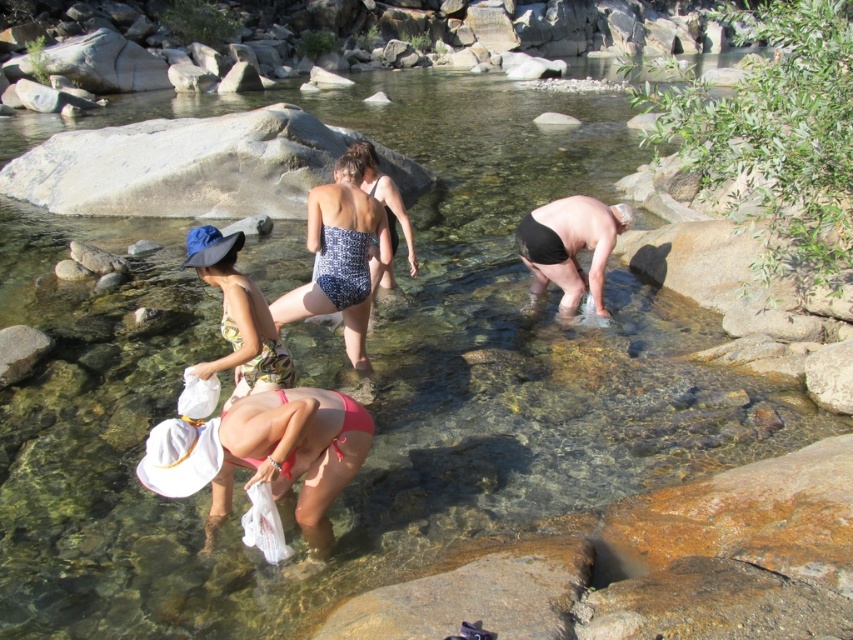
Does patterned fabric swimsuit at center have a greater width compared to black matte shorts at center?

No.

In the scene shown: Is the position of patterned fabric swimsuit at center less distant than that of black matte shorts at center?

Yes, it is in front of black matte shorts at center.

Does point (361, 172) lie behind point (534, 225)?

That is False.

The width and height of the screenshot is (853, 640). Find the location of `patterned fabric swimsuit at center`. patterned fabric swimsuit at center is located at coordinates (340, 257).

Is pink fabric bikini at lower center taller than patterned fabric swimsuit at center?

No, pink fabric bikini at lower center is not taller than patterned fabric swimsuit at center.

Between point (149, 442) and point (318, 244), which one is positioned in front?

Point (149, 442)

Which is behind, point (258, 403) or point (329, 237)?

The point (329, 237) is more distant.

Find the location of a particular element. pink fabric bikini at lower center is located at coordinates (265, 458).

Does point (590, 202) lie in front of point (3, 355)?

No, it is not.

What do you see at coordinates (570, 246) in the screenshot?
I see `black matte shorts at center` at bounding box center [570, 246].

Locate an element on the screen. black matte shorts at center is located at coordinates (570, 246).

Where is `black matte shorts at center`? black matte shorts at center is located at coordinates (570, 246).